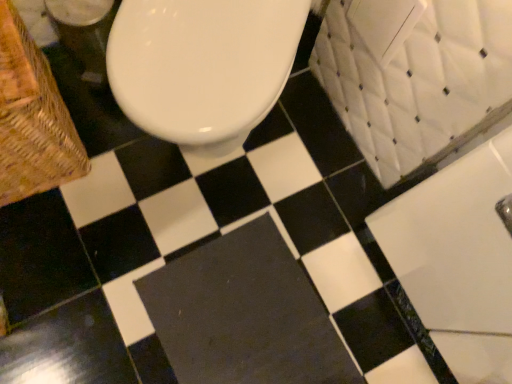
Question: Does white glossy bath at upper right have a greater height compared to dark gray rubber bath mat at center?

Choices:
 (A) yes
 (B) no

Answer: (A)

Question: Does white glossy bath at upper right lie in front of dark gray rubber bath mat at center?

Choices:
 (A) no
 (B) yes

Answer: (B)

Question: Is white glossy bath at upper right next to dark gray rubber bath mat at center?

Choices:
 (A) yes
 (B) no

Answer: (B)

Question: From the image's perspective, is white glossy bath at upper right located above dark gray rubber bath mat at center?

Choices:
 (A) yes
 (B) no

Answer: (A)

Question: Does white glossy bath at upper right have a greater width compared to dark gray rubber bath mat at center?

Choices:
 (A) yes
 (B) no

Answer: (B)

Question: Considering the positions of white glossy bath at upper right and dark gray rubber bath mat at center in the image, is white glossy bath at upper right bigger or smaller than dark gray rubber bath mat at center?

Choices:
 (A) big
 (B) small

Answer: (A)

Question: Considering their positions, is white glossy bath at upper right located in front of or behind dark gray rubber bath mat at center?

Choices:
 (A) front
 (B) behind

Answer: (A)

Question: Visually, is white glossy bath at upper right positioned to the left or to the right of dark gray rubber bath mat at center?

Choices:
 (A) left
 (B) right

Answer: (B)

Question: From the image's perspective, is white glossy bath at upper right located above or below dark gray rubber bath mat at center?

Choices:
 (A) below
 (B) above

Answer: (B)

Question: From the image's perspective, is dark gray rubber bath mat at center above or below woven wood basket at left?

Choices:
 (A) above
 (B) below

Answer: (B)

Question: Considering the positions of point (305, 273) and point (31, 87), is point (305, 273) closer or farther from the camera than point (31, 87)?

Choices:
 (A) farther
 (B) closer

Answer: (A)

Question: From a real-world perspective, is dark gray rubber bath mat at center positioned above or below woven wood basket at left?

Choices:
 (A) below
 (B) above

Answer: (A)

Question: Based on their sizes in the image, would you say dark gray rubber bath mat at center is bigger or smaller than woven wood basket at left?

Choices:
 (A) big
 (B) small

Answer: (B)

Question: From their relative heights in the image, would you say woven wood basket at left is taller or shorter than dark gray rubber bath mat at center?

Choices:
 (A) short
 (B) tall

Answer: (B)

Question: From the image's perspective, is woven wood basket at left positioned above or below dark gray rubber bath mat at center?

Choices:
 (A) below
 (B) above

Answer: (B)